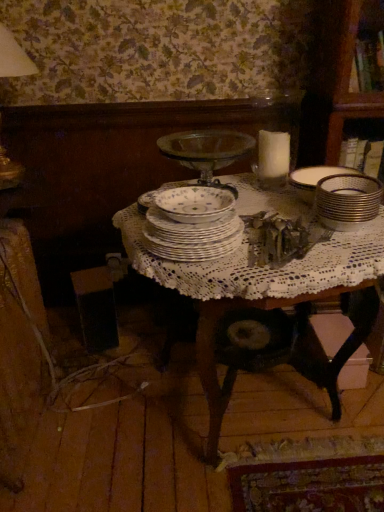
Question: Does porcelain plates at center appear on the left side of gold metallic stack at right?

Choices:
 (A) no
 (B) yes

Answer: (B)

Question: Does porcelain plates at center turn towards gold metallic stack at right?

Choices:
 (A) no
 (B) yes

Answer: (A)

Question: Can you confirm if porcelain plates at center is wider than gold metallic stack at right?

Choices:
 (A) no
 (B) yes

Answer: (B)

Question: Does porcelain plates at center appear on the right side of gold metallic stack at right?

Choices:
 (A) yes
 (B) no

Answer: (B)

Question: Is porcelain plates at center bigger than gold metallic stack at right?

Choices:
 (A) no
 (B) yes

Answer: (B)

Question: Is gold metallic stack at right in front of or behind porcelain plates at center in the image?

Choices:
 (A) behind
 (B) front

Answer: (A)

Question: Choose the correct answer: Is gold metallic stack at right inside porcelain plates at center or outside it?

Choices:
 (A) outside
 (B) inside

Answer: (A)

Question: Is point (334, 202) closer or farther from the camera than point (221, 247)?

Choices:
 (A) closer
 (B) farther

Answer: (B)

Question: Considering the positions of gold metallic stack at right and porcelain plates at center in the image, is gold metallic stack at right bigger or smaller than porcelain plates at center?

Choices:
 (A) big
 (B) small

Answer: (B)

Question: Does point (210, 201) appear closer or farther from the camera than point (241, 293)?

Choices:
 (A) closer
 (B) farther

Answer: (B)

Question: Visually, is porcelain floral bowl at center positioned to the left or to the right of white lace tablecloth at center?

Choices:
 (A) left
 (B) right

Answer: (A)

Question: Is porcelain floral bowl at center taller or shorter than white lace tablecloth at center?

Choices:
 (A) tall
 (B) short

Answer: (B)

Question: Considering the positions of porcelain floral bowl at center and white lace tablecloth at center in the image, is porcelain floral bowl at center bigger or smaller than white lace tablecloth at center?

Choices:
 (A) big
 (B) small

Answer: (B)

Question: Does point (321, 200) appear closer or farther from the camera than point (213, 220)?

Choices:
 (A) farther
 (B) closer

Answer: (A)

Question: From the image's perspective, is gold metallic stack at right positioned above or below porcelain floral bowl at center?

Choices:
 (A) below
 (B) above

Answer: (A)